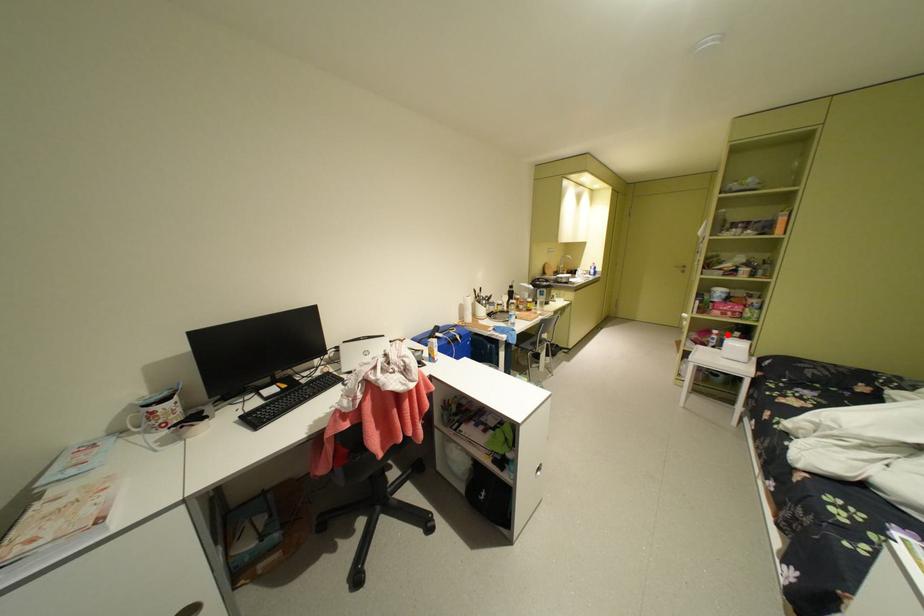
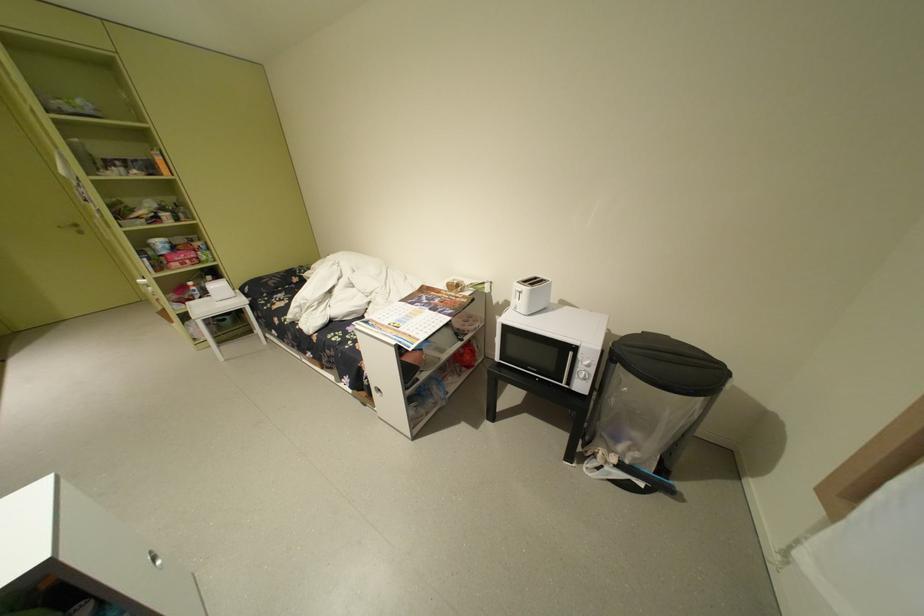
The point at the highlighted location is marked in the first image. Where is the corresponding point in the second image?

(204, 286)